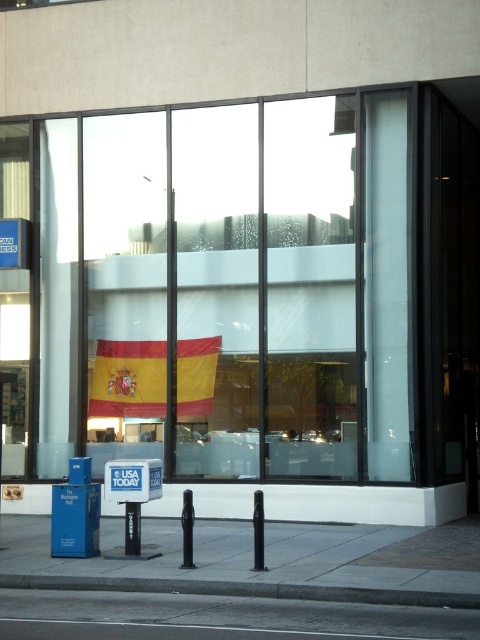
You are standing on the sidewalk in front of the modern building and want to walk from the blue newspaper dispenser to the street scene reflected in the glass window. Which point, point (382, 496) or point (88, 572), is closer to you as you start walking towards the street scene?

Point (88, 572) is closer to you because it is less further to the viewer than point (382, 496), so you would reach it first when walking towards the street scene.

You are a delivery person trying to park your bike. You see the gray concrete pavement at lower center and the gray asphalt at lower center. Which surface is suitable for parking your bike?

The gray asphalt at lower center is suitable for parking the bike since the gray concrete pavement at lower center is positioned under it, indicating it might be part of the building structure or not accessible.